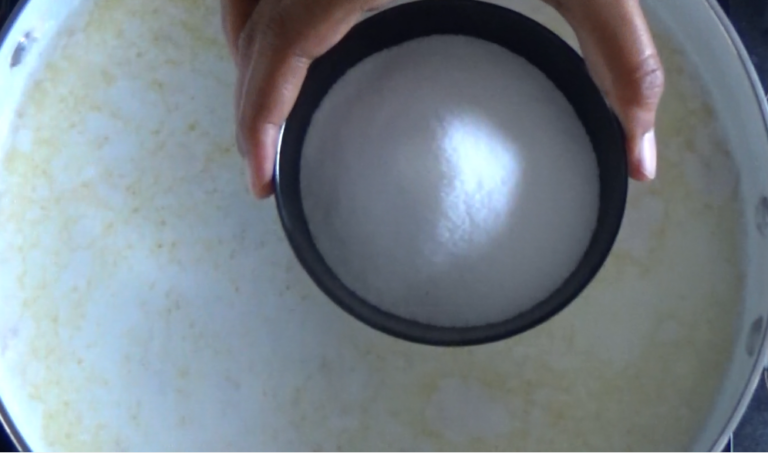
Where is `surface of frying pan`? The image size is (768, 453). surface of frying pan is located at coordinates (210, 290).